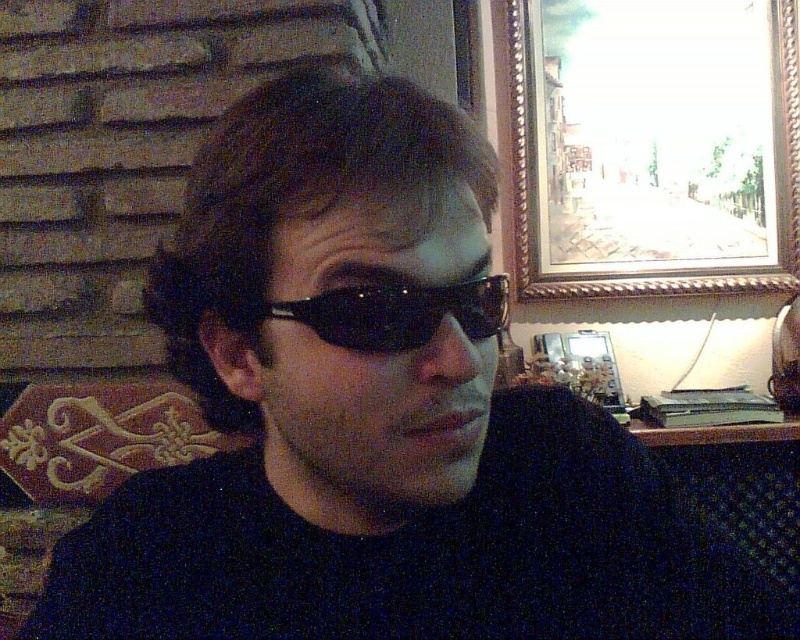
Question: Which point is farther to the camera?

Choices:
 (A) black plastic goggles at center
 (B) gold/gilded picture frame at upper right

Answer: (B)

Question: Is gold/gilded picture frame at upper right positioned behind black plastic goggles at center?

Choices:
 (A) yes
 (B) no

Answer: (A)

Question: Which point is closer to the camera?

Choices:
 (A) (374, 323)
 (B) (560, 33)

Answer: (A)

Question: From the image, what is the correct spatial relationship of gold/gilded picture frame at upper right in relation to black plastic goggles at center?

Choices:
 (A) below
 (B) above

Answer: (B)

Question: Can you confirm if gold/gilded picture frame at upper right is positioned above black plastic goggles at center?

Choices:
 (A) no
 (B) yes

Answer: (B)